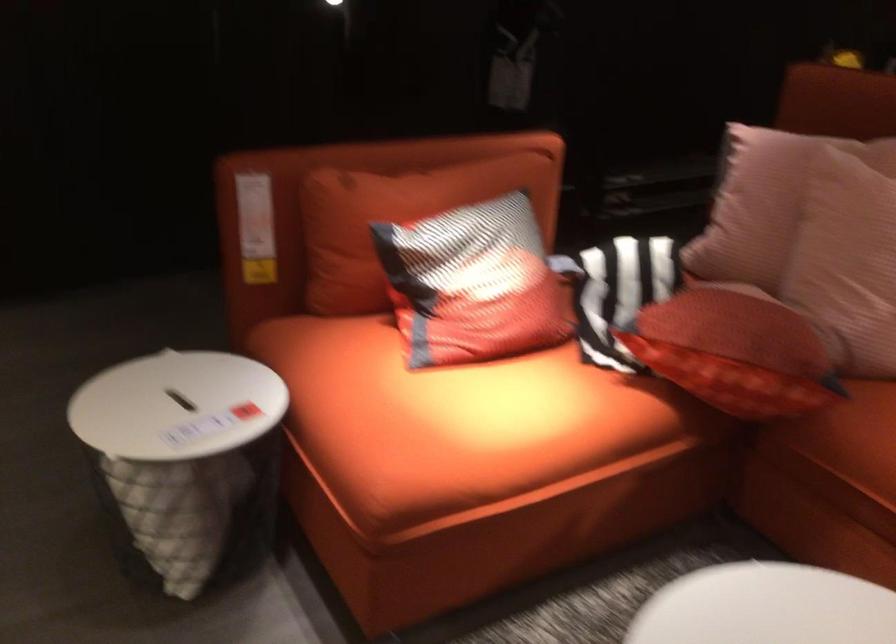
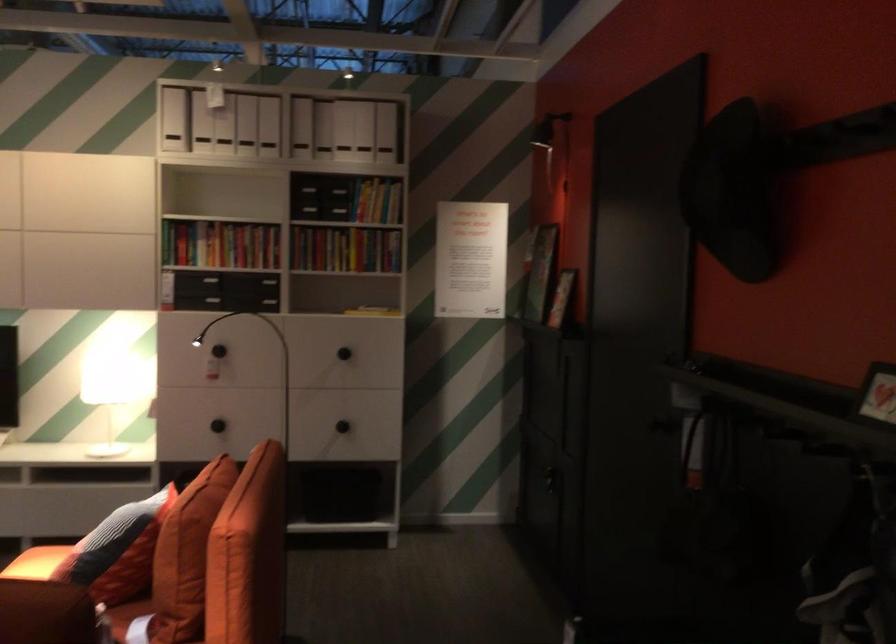
The point at (455, 386) is marked in the first image. Where is the corresponding point in the second image?

(36, 563)